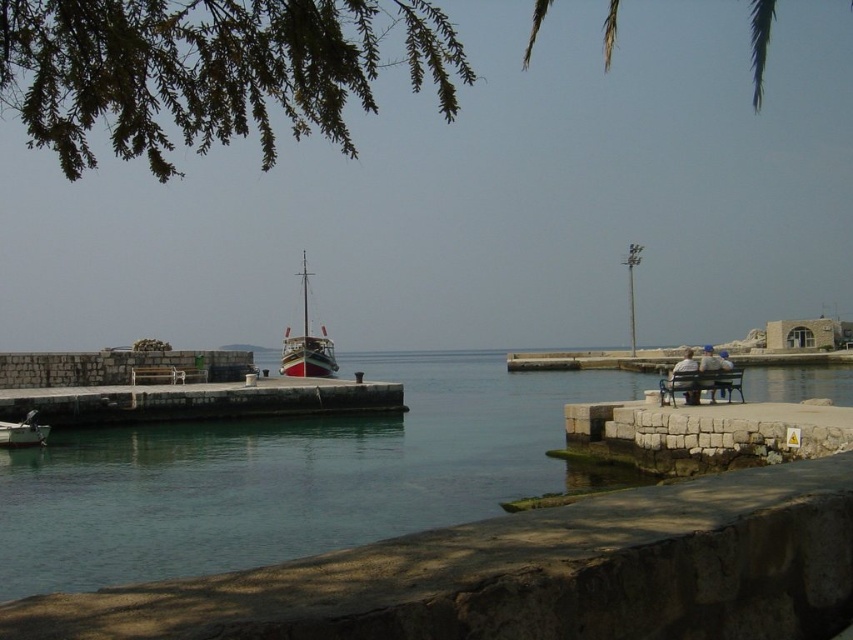
You are a photographer wanting to capture both the wooden polished boat at center and the wooden bench at right in the same frame. Based on their positions, which object should you position closer to the left side of your camera viewfinder?

The wooden polished boat at center should be positioned closer to the left side of the camera viewfinder since it is located to the left of the wooden bench at right.

You are standing at the edge of the scene and want to walk towards the green water at center. Which direction should you move relative to the blue denim jeans at lower right?

The green water at center is located below the blue denim jeans at lower right, so you should move downward from the blue denim jeans at lower right to reach the green water at center.